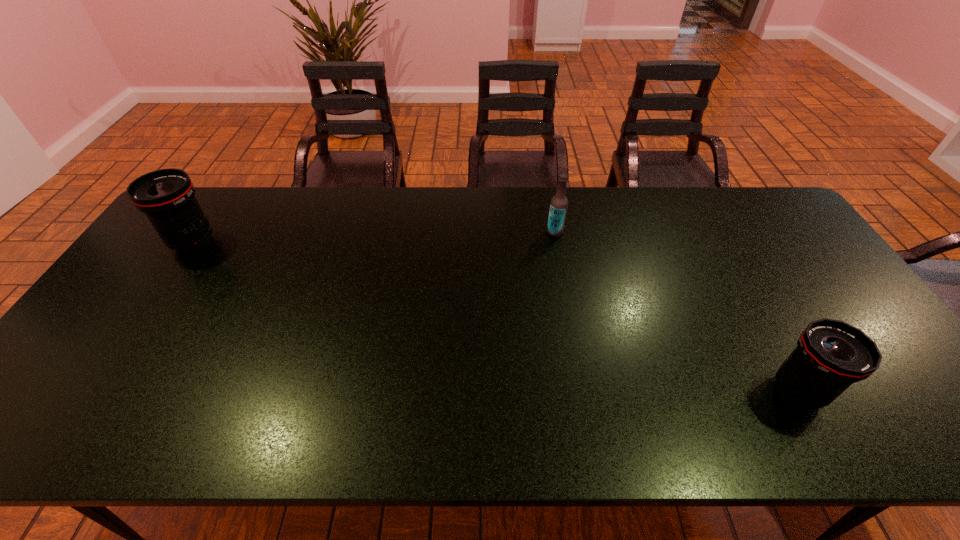
Find the location of `vacant point located between the second object from right to left and the left telephoto lens`. vacant point located between the second object from right to left and the left telephoto lens is located at coordinates (374, 237).

Point out which object is positioned as the nearest to the taller telephoto lens. Please provide its 2D coordinates. Your answer should be formatted as a tuple, i.e. [(x, y)], where the tuple contains the x and y coordinates of a point satisfying the conditions above.

[(558, 207)]

Locate an element on the screen. object that is the closest to the beer bottle is located at coordinates (831, 355).

Locate an element on the screen. The width and height of the screenshot is (960, 540). vacant position in the image that satisfies the following two spatial constraints: 1. on the front side of the left telephoto lens; 2. on the left side of the shorter telephoto lens is located at coordinates click(x=93, y=391).

At what (x,y) coordinates should I click in order to perform the action: click on free region that satisfies the following two spatial constraints: 1. on the side of the second object from left to right with the label; 2. on the front side of the taller telephoto lens. Please return your answer as a coordinate pair (x, y). The height and width of the screenshot is (540, 960). Looking at the image, I should click on (557, 242).

Locate an element on the screen. This screenshot has height=540, width=960. vacant position in the image that satisfies the following two spatial constraints: 1. on the side of the beer bottle with the label; 2. on the front side of the farther telephoto lens is located at coordinates (557, 242).

The height and width of the screenshot is (540, 960). In order to click on vacant space that satisfies the following two spatial constraints: 1. on the side of the beer bottle with the label; 2. on the front side of the leftmost object in this screenshot , I will do `click(557, 242)`.

This screenshot has height=540, width=960. I want to click on free space that satisfies the following two spatial constraints: 1. on the front side of the shorter telephoto lens; 2. on the right side of the farther telephoto lens, so click(93, 391).